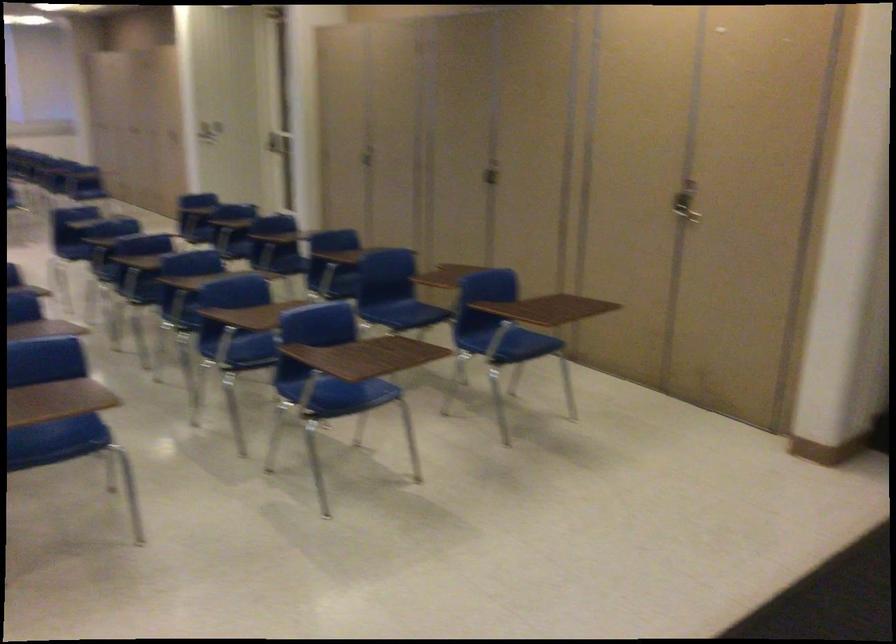
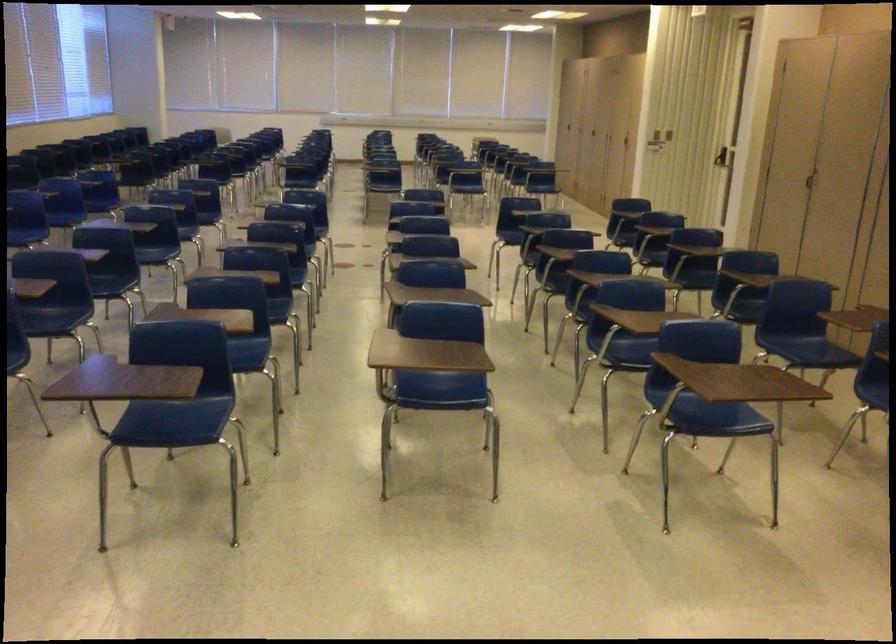
Find the pixel in the second image that matches (239,343) in the first image.

(625, 345)